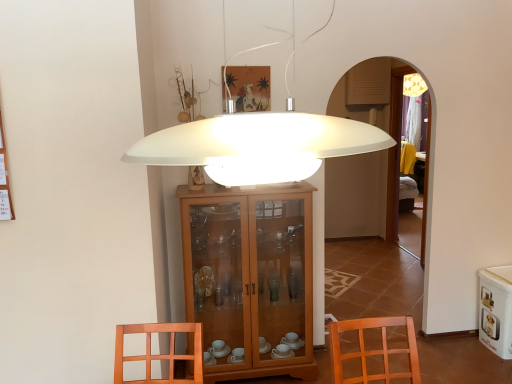
Question: Is white matte lampshade at center shorter than matte wooden picture frame at upper center?

Choices:
 (A) yes
 (B) no

Answer: (B)

Question: Are white matte lampshade at center and matte wooden picture frame at upper center far apart?

Choices:
 (A) yes
 (B) no

Answer: (A)

Question: From the image's perspective, is white matte lampshade at center over matte wooden picture frame at upper center?

Choices:
 (A) no
 (B) yes

Answer: (A)

Question: Can you confirm if white matte lampshade at center is positioned to the left of matte wooden picture frame at upper center?

Choices:
 (A) yes
 (B) no

Answer: (B)

Question: Does white matte lampshade at center have a smaller size compared to matte wooden picture frame at upper center?

Choices:
 (A) yes
 (B) no

Answer: (B)

Question: Is white matte lampshade at center in front of matte wooden picture frame at upper center?

Choices:
 (A) yes
 (B) no

Answer: (A)

Question: From a real-world perspective, is white glossy pet food container at lower right located higher than wooden cabinet at center?

Choices:
 (A) no
 (B) yes

Answer: (A)

Question: Would you say white glossy pet food container at lower right contains wooden cabinet at center?

Choices:
 (A) no
 (B) yes

Answer: (A)

Question: From the image's perspective, is white glossy pet food container at lower right over wooden cabinet at center?

Choices:
 (A) no
 (B) yes

Answer: (A)

Question: Is white glossy pet food container at lower right facing away from wooden cabinet at center?

Choices:
 (A) yes
 (B) no

Answer: (B)

Question: Is white glossy pet food container at lower right shorter than wooden cabinet at center?

Choices:
 (A) no
 (B) yes

Answer: (B)

Question: Does white glossy pet food container at lower right lie behind wooden cabinet at center?

Choices:
 (A) no
 (B) yes

Answer: (B)

Question: Is wooden cabinet at center to the right of white glossy pet food container at lower right from the viewer's perspective?

Choices:
 (A) yes
 (B) no

Answer: (B)